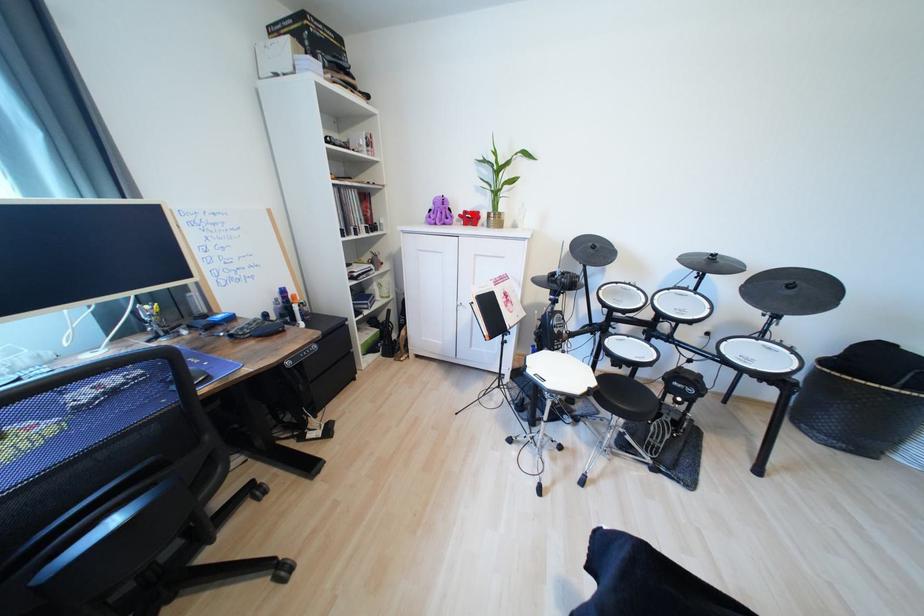
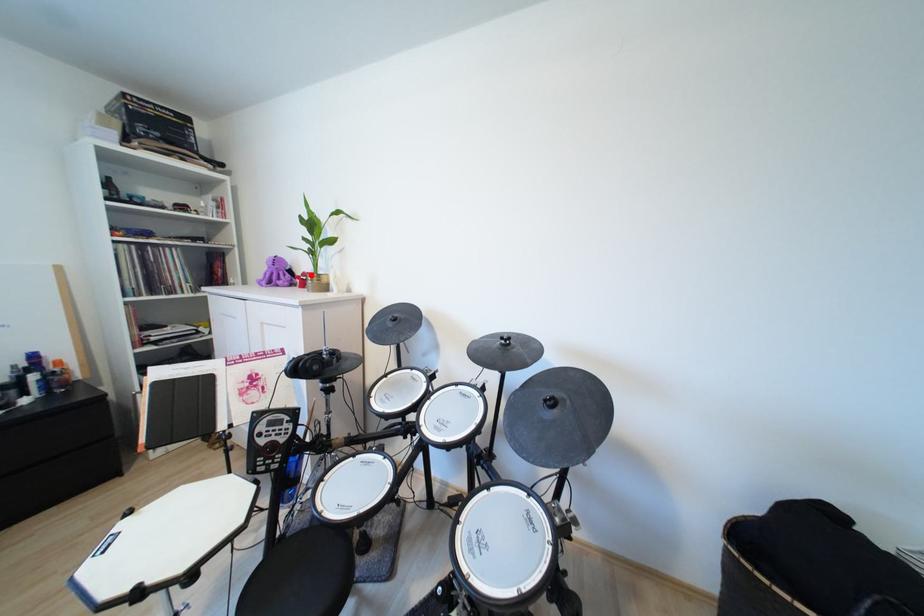
I am providing you with two images of the same scene from different viewpoints. A red point is marked on the first image and another point is marked on the second image. Are the points marked in image1 and image2 representing the same 3D position?

Yes